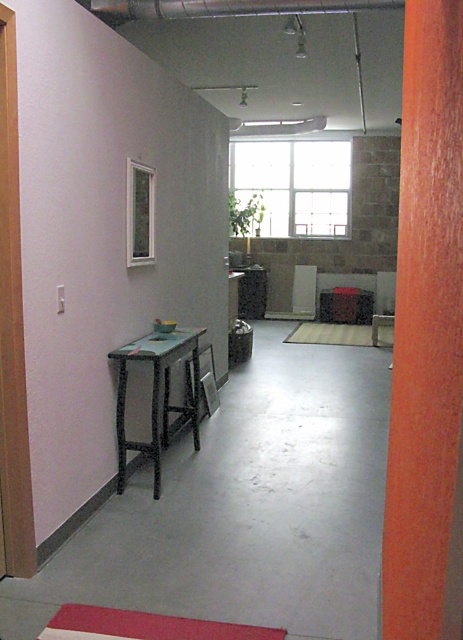
Question: Does orange wood pillar at right have a smaller size compared to matte wood chair at center?

Choices:
 (A) yes
 (B) no

Answer: (B)

Question: Which of the following is the farthest from the observer?

Choices:
 (A) (199, 333)
 (B) (406, 628)

Answer: (A)

Question: Does orange wood pillar at right have a larger size compared to matte wood chair at center?

Choices:
 (A) yes
 (B) no

Answer: (A)

Question: Which is farther from the red rubber mat at center?

Choices:
 (A) orange wood pillar at right
 (B) matte black table at left
 (C) red rubber mat at lower center
 (D) matte wood chair at center

Answer: (C)

Question: Does orange wood pillar at right have a greater width compared to red rubber mat at lower center?

Choices:
 (A) yes
 (B) no

Answer: (B)

Question: Which object appears closest to the camera in this image?

Choices:
 (A) matte wood chair at center
 (B) orange wood pillar at right
 (C) red rubber mat at center
 (D) red rubber mat at lower center

Answer: (B)